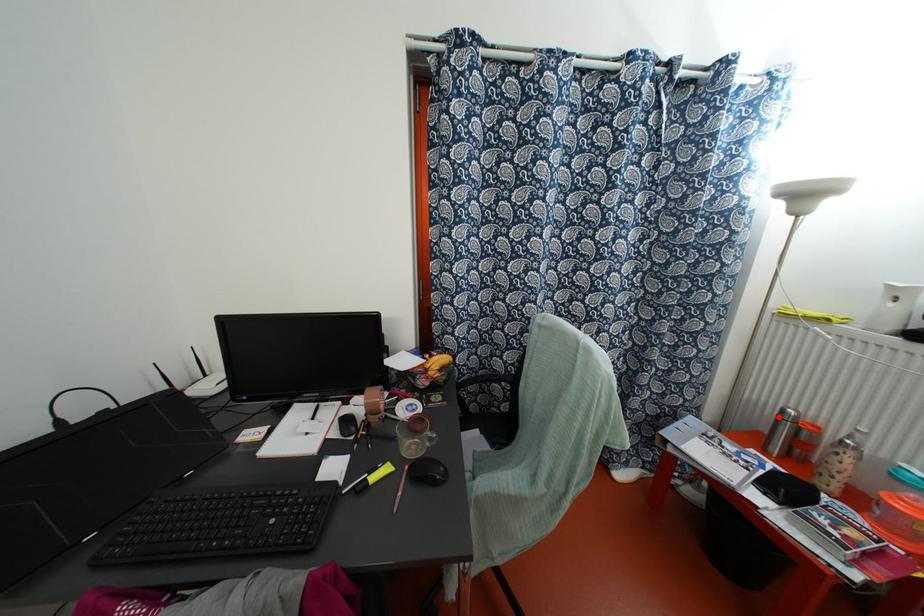
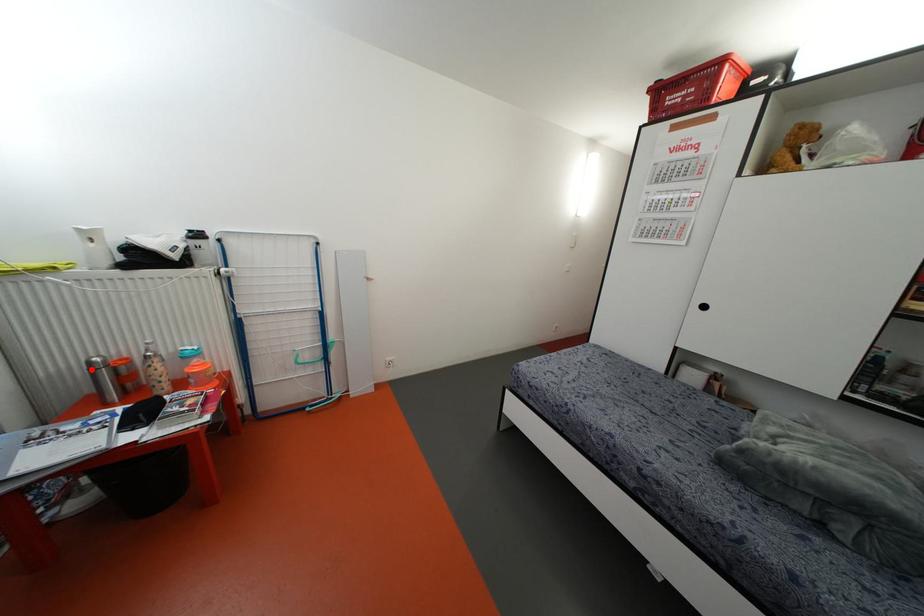
I am providing you with two images of the same scene from different viewpoints. A red point is marked on the first image and another point is marked on the second image. Are the points marked in image1 and image2 representing the same 3D position?

Yes